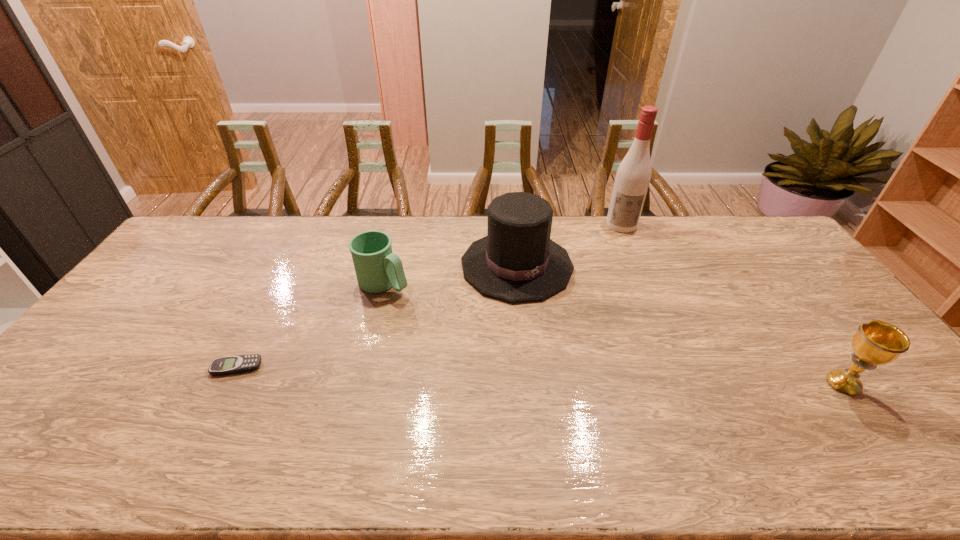
Find the location of a particular element. the leftmost object is located at coordinates (241, 363).

The height and width of the screenshot is (540, 960). Identify the location of beeper. (241, 363).

Find the location of a particular element. The width and height of the screenshot is (960, 540). the third tallest object is located at coordinates (876, 342).

Locate an element on the screen. Image resolution: width=960 pixels, height=540 pixels. chalice is located at coordinates 876,342.

Locate an element on the screen. mug is located at coordinates (377, 268).

This screenshot has height=540, width=960. What are the coordinates of `the second object from left to right` in the screenshot? It's located at (377, 268).

In order to click on dress hat in this screenshot , I will do point(517,261).

I want to click on the fourth shortest object, so click(x=517, y=261).

At what (x,y) coordinates should I click in order to perform the action: click on alcohol. Please return your answer as a coordinate pair (x, y). Looking at the image, I should click on (633, 176).

Where is `the fourth object from left to right`? Image resolution: width=960 pixels, height=540 pixels. the fourth object from left to right is located at coordinates [x=633, y=176].